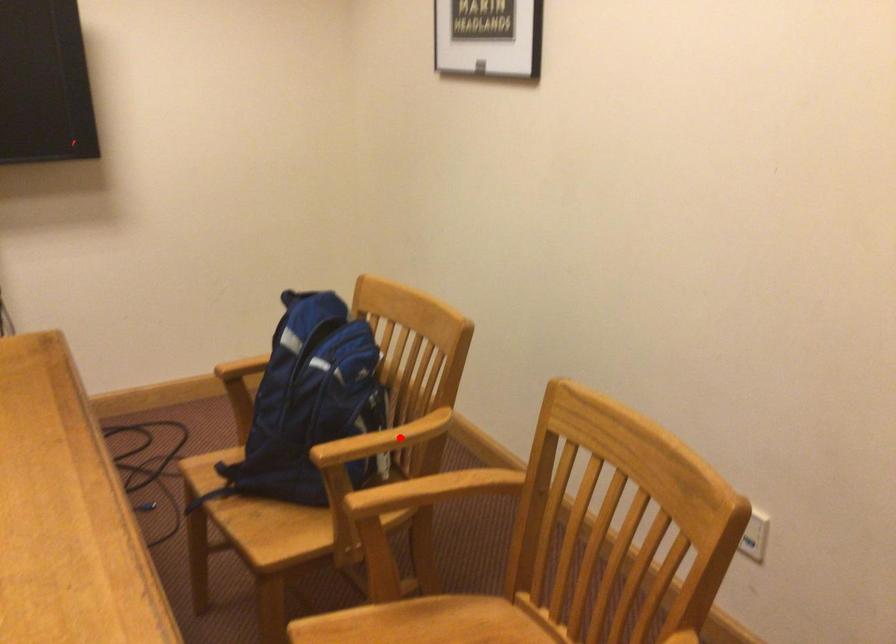
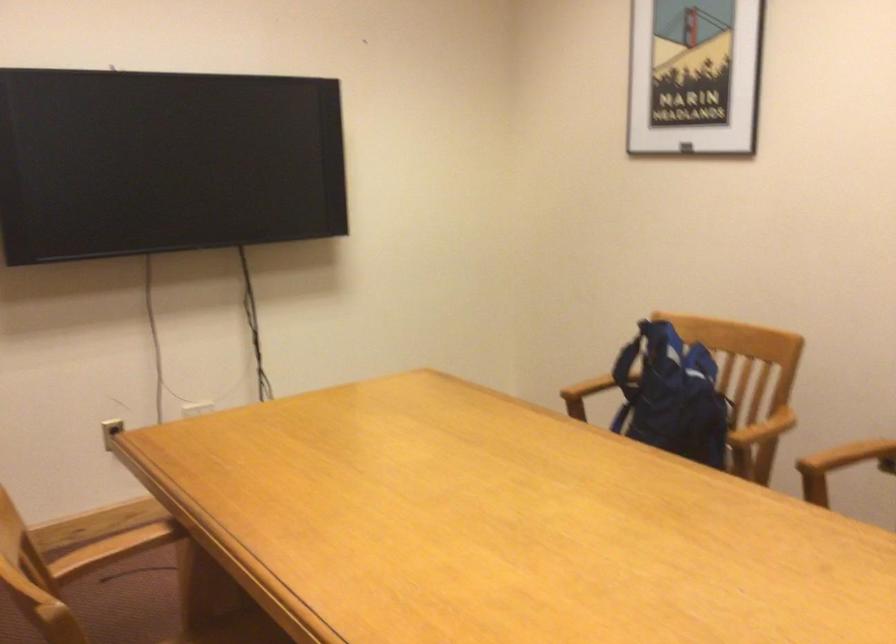
Find the pixel in the second image that matches the highlighted location in the first image.

(763, 428)